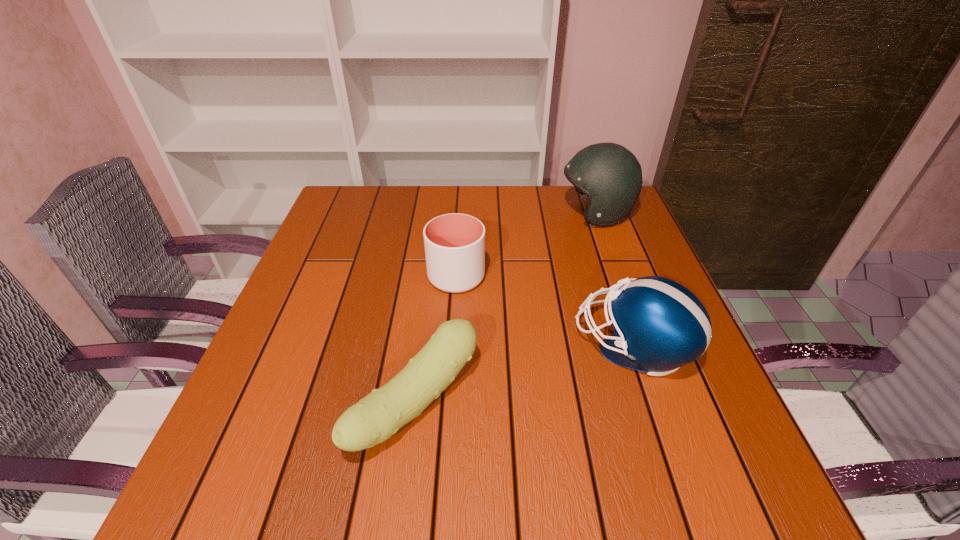
You are a GUI agent. You are given a task and a screenshot of the screen. Output one action in this format:
    pyautogui.click(x=<x>, y=<y>)
    Task: Click on the farther football helmet
    The width and height of the screenshot is (960, 540).
    Given the screenshot: What is the action you would take?
    pyautogui.click(x=609, y=176)

Find the location of a particular element. The height and width of the screenshot is (540, 960). the tallest object is located at coordinates (609, 176).

Locate an element on the screen. The width and height of the screenshot is (960, 540). the shorter football helmet is located at coordinates pyautogui.click(x=659, y=325).

This screenshot has height=540, width=960. I want to click on the second tallest object, so click(659, 325).

Identify the location of the second shortest object. Image resolution: width=960 pixels, height=540 pixels. (454, 243).

Find the location of a particular element. cup is located at coordinates (454, 243).

This screenshot has height=540, width=960. Find the location of `the shortest object`. the shortest object is located at coordinates (375, 418).

Where is `vacant space located 0.230m at the face opening of the farthest object`? This screenshot has width=960, height=540. vacant space located 0.230m at the face opening of the farthest object is located at coordinates pos(479,213).

The width and height of the screenshot is (960, 540). In order to click on blank area located 0.090m at the face opening of the farthest object in this screenshot , I will do `click(527, 213)`.

In order to click on free space located 0.110m at the face opening of the farthest object in this screenshot , I will do `click(520, 213)`.